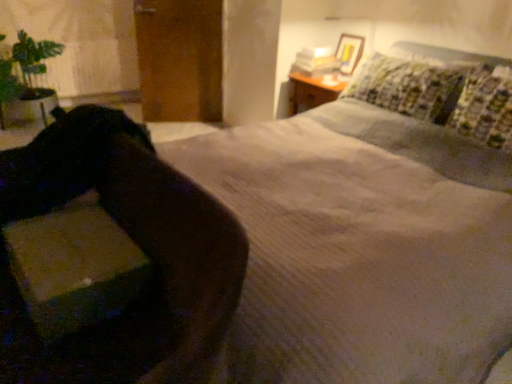
Question: Considering the positions of green leafy plant at left and velvet-like brown swivel chair at lower left in the image, is green leafy plant at left taller or shorter than velvet-like brown swivel chair at lower left?

Choices:
 (A) tall
 (B) short

Answer: (A)

Question: In terms of width, does green leafy plant at left look wider or thinner when compared to velvet-like brown swivel chair at lower left?

Choices:
 (A) wide
 (B) thin

Answer: (A)

Question: Estimate the real-world distances between objects in this image. Which object is farther from the matte cardboard box at lower left?

Choices:
 (A) velvet-like brown swivel chair at lower left
 (B) green leafy plant at left

Answer: (B)

Question: Estimate the real-world distances between objects in this image. Which object is farther from the velvet-like brown swivel chair at lower left?

Choices:
 (A) green leafy plant at left
 (B) matte cardboard box at lower left

Answer: (A)